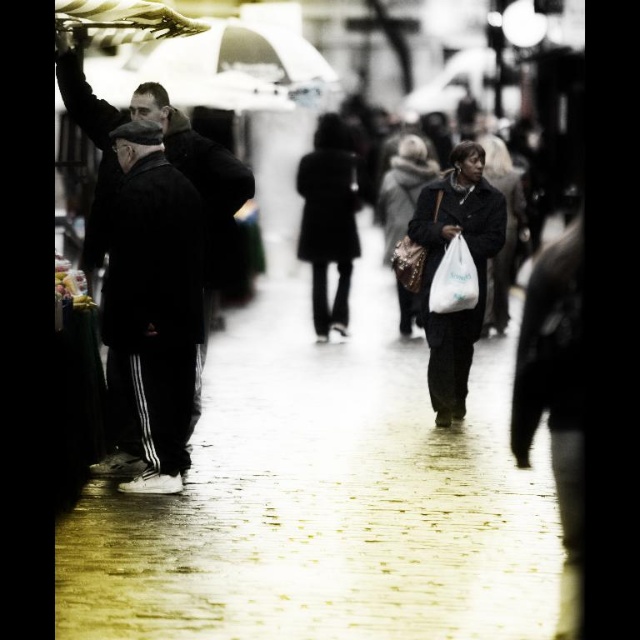
Consider the image. You are a photographer standing in the middle of the street market. You notice the black matte pants at left and the matte black coat at center. Which object is positioned lower in the image?

The black matte pants at left is located below the matte black coat at center, so it is positioned lower in the image.

You are a customer at the market and want to stay dry while looking at the fabric. Can you stand under the transparent plastic umbrella at upper left to stay dry while also being near the matte black coat at center?

The matte black coat at center is positioned under the transparent plastic umbrella at upper left, so yes, you can stand under the transparent plastic umbrella at upper left and be near the matte black coat at center while staying dry.